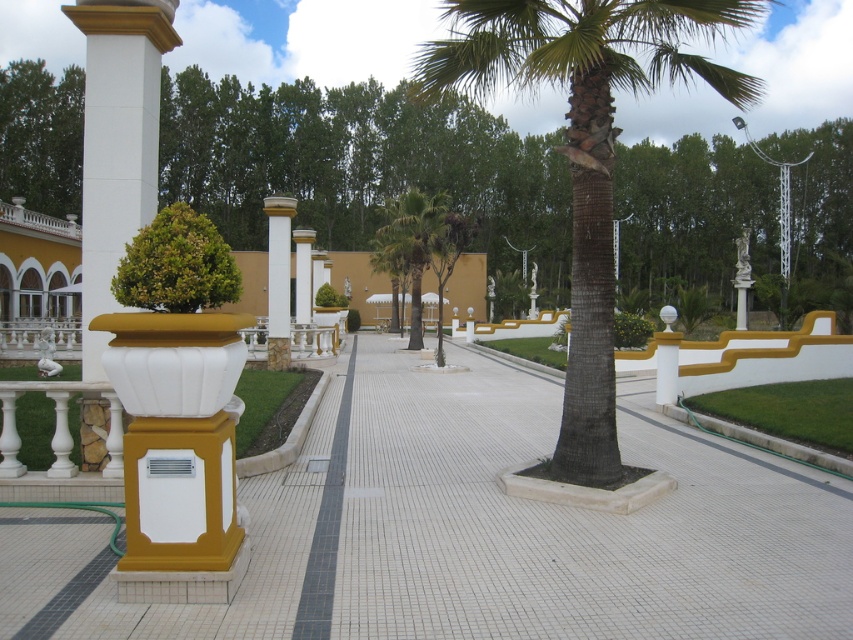
Between black tile line at center and green leafy palm tree at center, which one is positioned higher?

Positioned higher is green leafy palm tree at center.

What do you see at coordinates (326, 529) in the screenshot?
I see `black tile line at center` at bounding box center [326, 529].

The width and height of the screenshot is (853, 640). I want to click on black tile line at center, so click(326, 529).

Is brown textured palm tree at center below black tile line at center?

Actually, brown textured palm tree at center is above black tile line at center.

Is brown textured palm tree at center positioned in front of black tile line at center?

No, brown textured palm tree at center is further to the viewer.

Between point (577, 435) and point (326, 618), which one is positioned behind?

The point (577, 435) is behind.

Find the location of `brown textured palm tree at center`. brown textured palm tree at center is located at coordinates (585, 148).

Which is behind, point (65, 561) or point (575, 147)?

Point (575, 147)

Measure the distance between white tile pavement at center and camera.

white tile pavement at center and camera are 4.12 meters apart.

Is point (653, 628) less distant than point (579, 349)?

Yes, it is.

This screenshot has height=640, width=853. I want to click on white tile pavement at center, so click(x=473, y=531).